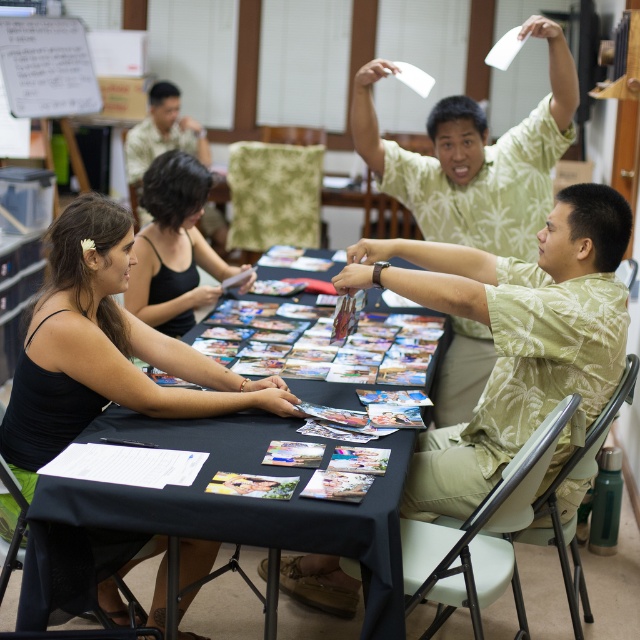
Who is taller, green floral shirt at right or black tank top at upper left?

With more height is green floral shirt at right.

Which is in front, point (440, 506) or point (173, 262)?

Point (440, 506)

You are a GUI agent. You are given a task and a screenshot of the screen. Output one action in this format:
    pyautogui.click(x=<x>, y=<y>)
    Task: Click on the green floral shirt at right
    This screenshot has width=640, height=640.
    Given the screenshot: What is the action you would take?
    pyautogui.click(x=513, y=333)

Where is `green floral shirt at right`? The height and width of the screenshot is (640, 640). green floral shirt at right is located at coordinates (513, 333).

Is green floral shirt at right below green leaf-patterned shirt at upper right?

Yes.

Can you confirm if green floral shirt at right is positioned above green leaf-patterned shirt at upper right?

Actually, green floral shirt at right is below green leaf-patterned shirt at upper right.

The height and width of the screenshot is (640, 640). I want to click on green floral shirt at right, so click(513, 333).